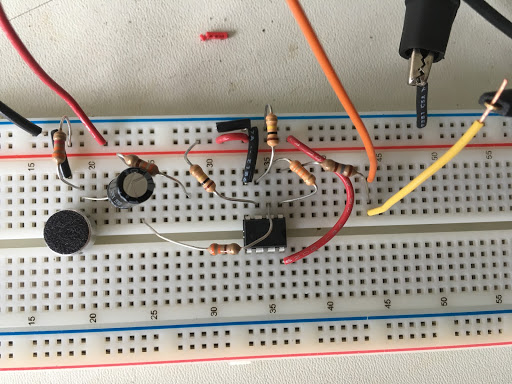
I want to click on table, so click(137, 35).